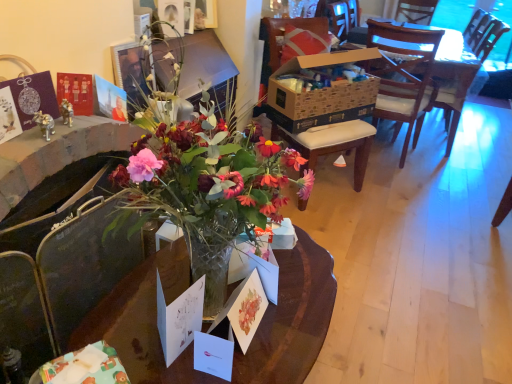
Question: Is brown cardboard box at center, the 1th box positioned from the right, inside the boundaries of white paper postcard at center, which appears as the second postcard when viewed from the left, or outside?

Choices:
 (A) outside
 (B) inside

Answer: (A)

Question: From a real-world perspective, is brown cardboard box at center, placed as the 1th box when sorted from top to bottom, positioned above or below white paper postcard at center, which appears as the second postcard when viewed from the left?

Choices:
 (A) below
 (B) above

Answer: (B)

Question: Considering the real-world distances, which object is closest to the wooden cushioned chair at center?

Choices:
 (A) white paper postcard at center, which is the 1th postcard from left to right
 (B) wooden armchair at center
 (C) translucent glass vase at center
 (D) matte paper postcard at center, the third postcard when ordered from left to right
 (E) white paper postcard at center, which appears as the second postcard when viewed from the left

Answer: (B)

Question: Estimate the real-world distances between objects in this image. Which object is farther from the white paper postcard at center, which is the 1th postcard from left to right?

Choices:
 (A) translucent glass vase at center
 (B) brown cardboard box at center, placed as the 2th box when sorted from left to right
 (C) white matte box at center, the 2th box positioned from the top
 (D) matte paper postcard at center, the third postcard when ordered from left to right
 (E) white paper postcard at center, the 2th postcard in the right-to-left sequence

Answer: (B)